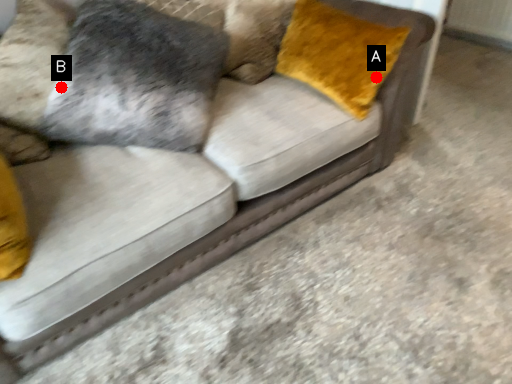
Question: Two points are circled on the image, labeled by A and B beside each circle. Which point appears closest to the camera in this image?

Choices:
 (A) A is closer
 (B) B is closer

Answer: (B)